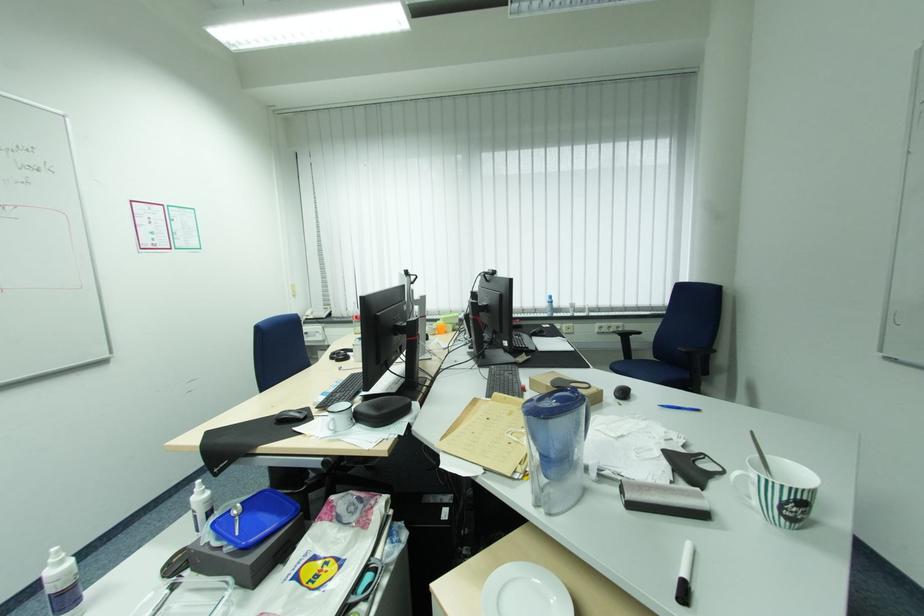
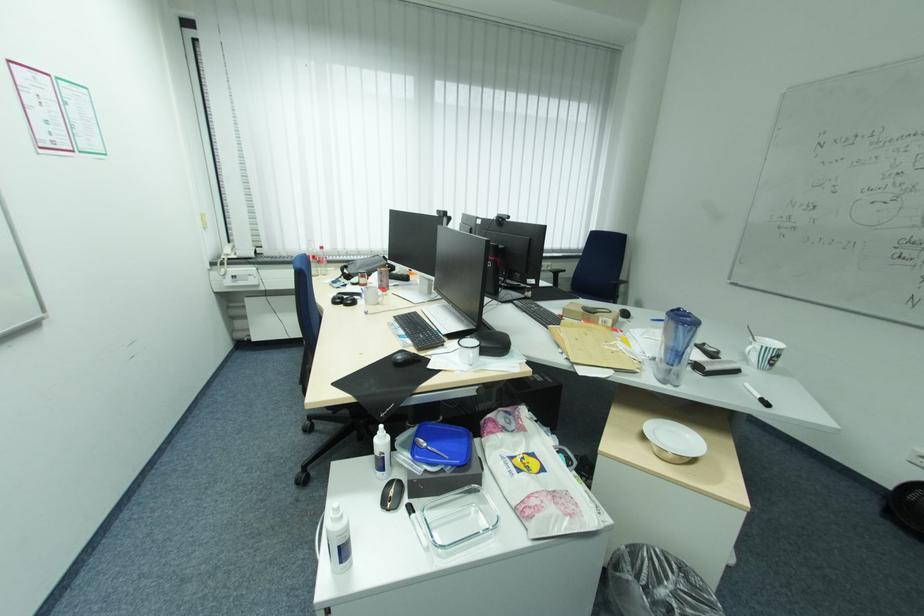
The point at (x=341, y=361) is marked in the first image. Where is the corresponding point in the second image?

(348, 305)